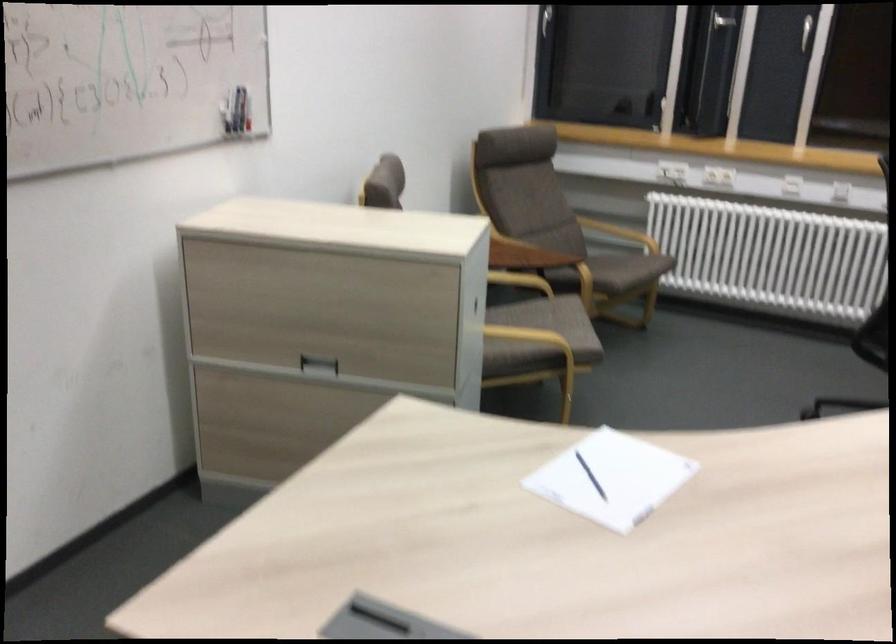
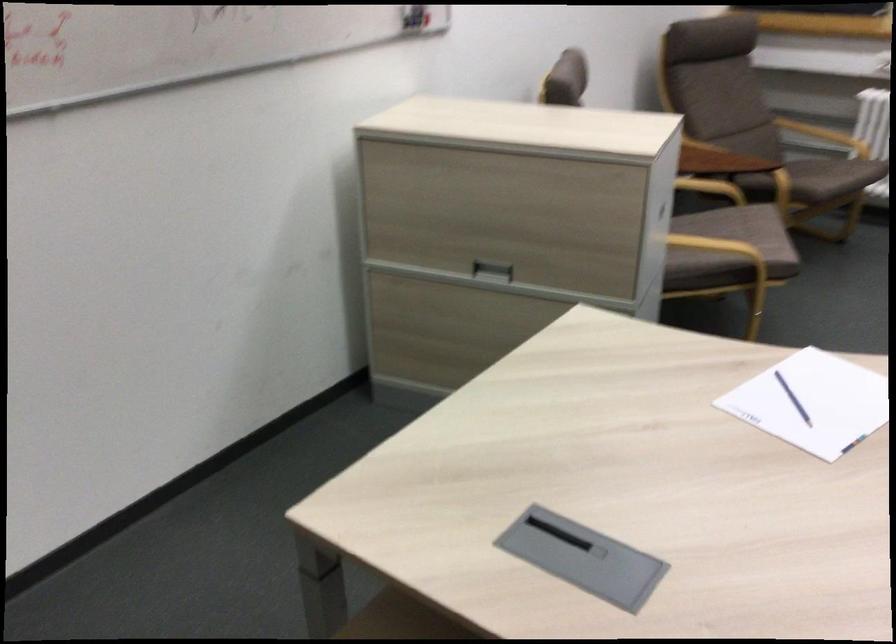
Question: The first image is from the beginning of the video and the second image is from the end. How did the camera likely rotate when shooting the video?

Choices:
 (A) Left
 (B) Right
 (C) Up
 (D) Down

Answer: (A)